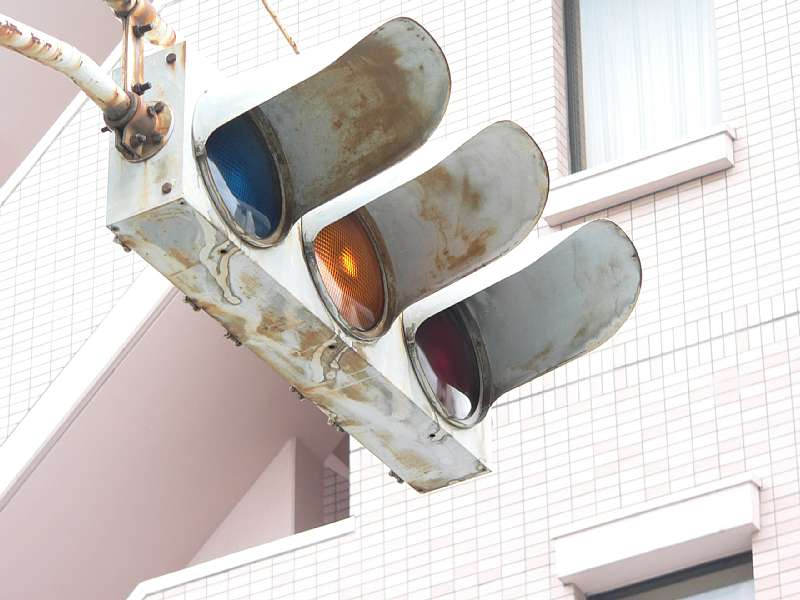
This screenshot has height=600, width=800. I want to click on yellow light, so click(x=354, y=298).